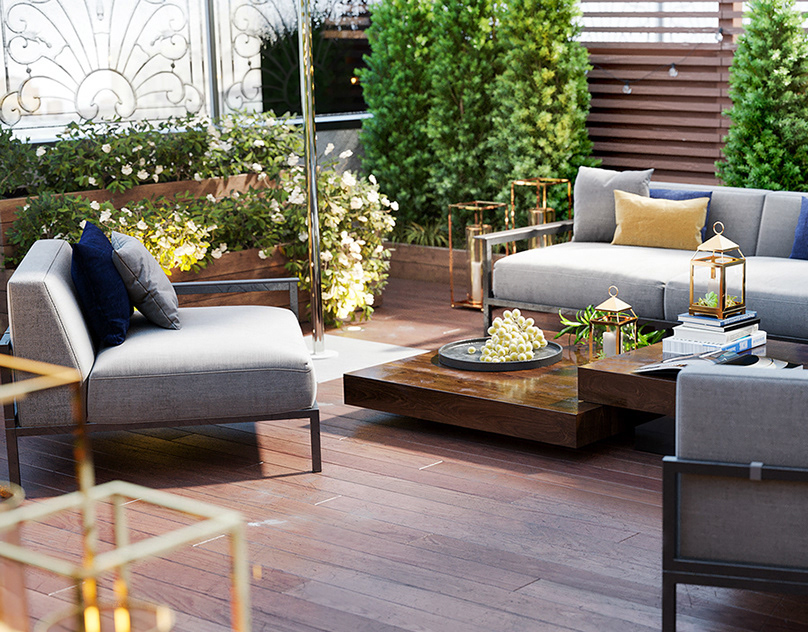
The width and height of the screenshot is (808, 632). I want to click on blinds, so click(638, 105).